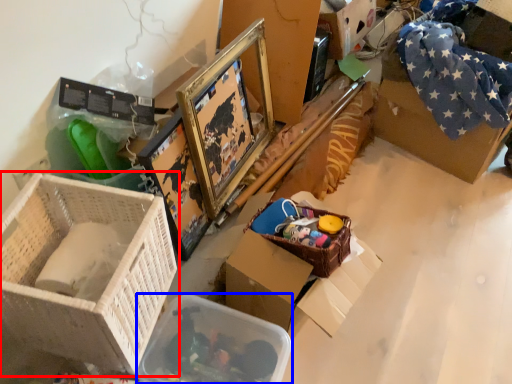
Question: Which object appears closest to the camera in this image, box (highlighted by a red box) or storage box (highlighted by a blue box)?

Choices:
 (A) box
 (B) storage box

Answer: (A)